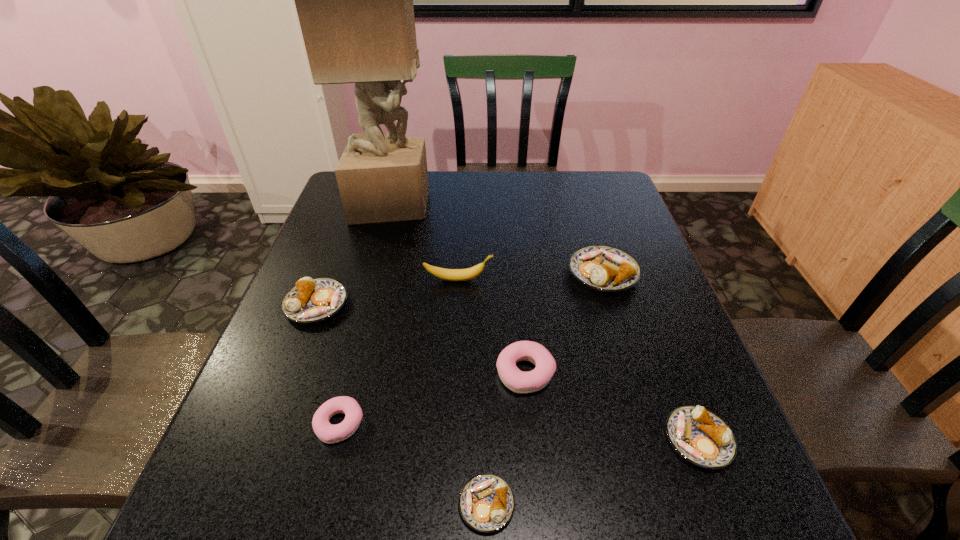
This screenshot has height=540, width=960. Identify the location of the farthest object. (354, 0).

This screenshot has width=960, height=540. Identify the location of the tallest object. (354, 0).

The width and height of the screenshot is (960, 540). I want to click on the second tallest object, so click(470, 273).

Find the location of a particular element. This screenshot has width=960, height=540. yellow banana is located at coordinates (470, 273).

Identify the location of the tallest pastry. The height and width of the screenshot is (540, 960). (605, 268).

This screenshot has height=540, width=960. Find the location of `the third tallest object`. the third tallest object is located at coordinates tap(605, 268).

The height and width of the screenshot is (540, 960). I want to click on the leftmost brown pastry, so click(x=311, y=300).

This screenshot has height=540, width=960. What are the coordinates of `the leftmost pastry` in the screenshot? It's located at (311, 300).

What are the coordinates of `the third farthest pastry` in the screenshot? It's located at (518, 381).

This screenshot has height=540, width=960. Find the location of `the farther pink pastry`. the farther pink pastry is located at coordinates (518, 381).